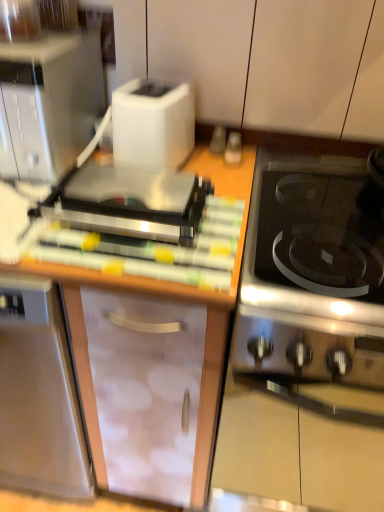
Where is `vacant area located to the right-hand side of satin silver toaster at upper left`? The width and height of the screenshot is (384, 512). vacant area located to the right-hand side of satin silver toaster at upper left is located at coordinates (226, 219).